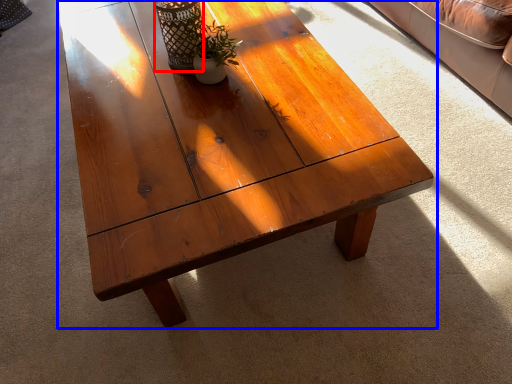
Question: Which of the following is the closest to the observer, glass vase (highlighted by a red box) or coffee table (highlighted by a blue box)?

Choices:
 (A) glass vase
 (B) coffee table

Answer: (B)